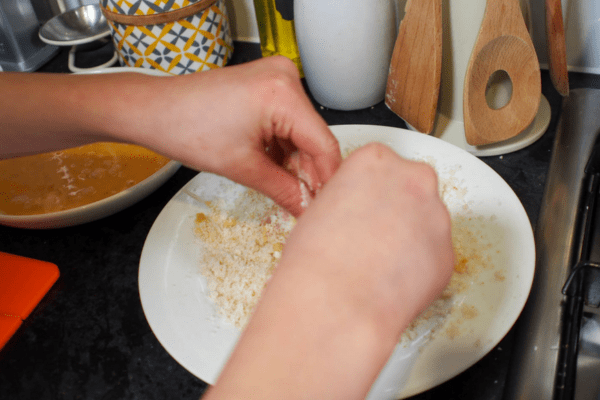
Locate an element on the screen. white vase is located at coordinates (343, 46).